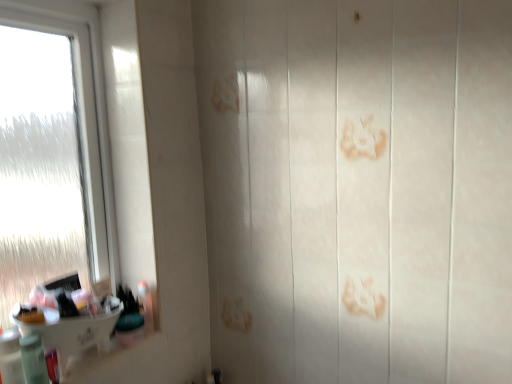
Question: Visually, is white glossy sink at lower left positioned to the left or to the right of green plastic container at lower left, the 4th toiletry from the front?

Choices:
 (A) left
 (B) right

Answer: (A)

Question: Would you say white glossy sink at lower left is inside or outside green plastic container at lower left, the 1th toiletry in the right-to-left sequence?

Choices:
 (A) outside
 (B) inside

Answer: (A)

Question: Estimate the real-world distances between objects in this image. Which object is farther from the green plastic container at lower left, the 4th toiletry from the front?

Choices:
 (A) translucent plastic bottle at lower left, the 4th toiletry in the right-to-left sequence
 (B) white glossy sink at lower left
 (C) translucent plastic bottle at lower left, which is the 3th toiletry in back-to-front order
 (D) transparent frosted glass at left
 (E) translucent plastic tube at lower left, acting as the second toiletry starting from the right

Answer: (D)

Question: Which of these objects is positioned closest to the translucent plastic tube at lower left, the third toiletry positioned from the front?

Choices:
 (A) translucent plastic bottle at lower left, which is the second toiletry in left-to-right order
 (B) transparent frosted glass at left
 (C) green plastic container at lower left, the first toiletry in the back-to-front sequence
 (D) white glossy sink at lower left
 (E) translucent plastic bottle at lower left, the 4th toiletry in the right-to-left sequence

Answer: (A)